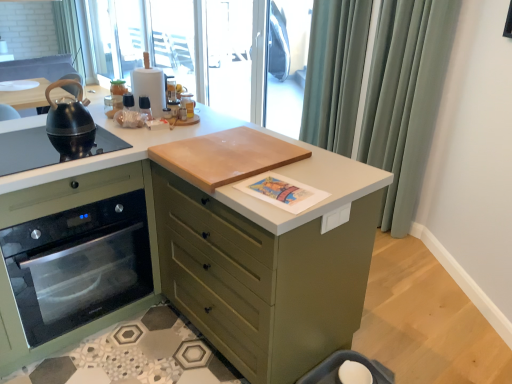
Describe the element at coordinates (27, 151) in the screenshot. I see `black matte gas stove at left` at that location.

What is the approximate width of white paper towel holder at upper center?

The width of white paper towel holder at upper center is 17.07 centimeters.

You are a GUI agent. You are given a task and a screenshot of the screen. Output one action in this format:
    pyautogui.click(x=<x>, y=<y>)
    Task: Click on the satin fabric curtain at upper right
    
    Given the screenshot: What is the action you would take?
    pyautogui.click(x=405, y=98)

At what (x,y) coordinates should I click in order to perform the action: click on black matte gas stove at left. Please return your answer as a coordinate pair (x, y). Looking at the image, I should click on (27, 151).

This screenshot has height=384, width=512. In order to click on the 1st screen door above the satin green oven at left (from the image's perspective) in this screenshot , I will do `click(287, 64)`.

Looking at this image, is satin green oven at left far from transparent plastic screen door at upper center, which ranks as the 2th screen door in left-to-right order?

Indeed, satin green oven at left is not near transparent plastic screen door at upper center, which ranks as the 2th screen door in left-to-right order.

Considering the sizes of transparent glass window at upper center, the 2th window screen in the back-to-front sequence, and transparent plastic window screen at upper center, positioned as the 1th window screen in left-to-right order, in the image, is transparent glass window at upper center, the 2th window screen in the back-to-front sequence, wider or thinner than transparent plastic window screen at upper center, positioned as the 1th window screen in left-to-right order,?

Clearly, transparent glass window at upper center, the 2th window screen in the back-to-front sequence, has less width compared to transparent plastic window screen at upper center, positioned as the 1th window screen in left-to-right order.

Is transparent glass window at upper center, which appears as the 1th window screen when viewed from the right, not close to transparent plastic window screen at upper center, the 2th window screen in the front-to-back sequence?

No, transparent glass window at upper center, which appears as the 1th window screen when viewed from the right, is not far away from transparent plastic window screen at upper center, the 2th window screen in the front-to-back sequence.

Considering the relative positions of transparent glass window at upper center, which appears as the second window screen when viewed from the left, and transparent plastic window screen at upper center, positioned as the 1th window screen in left-to-right order, in the image provided, is transparent glass window at upper center, which appears as the second window screen when viewed from the left, to the left or to the right of transparent plastic window screen at upper center, positioned as the 1th window screen in left-to-right order,?

transparent glass window at upper center, which appears as the second window screen when viewed from the left, is to the right of transparent plastic window screen at upper center, positioned as the 1th window screen in left-to-right order.

How far apart are transparent glass window at upper center, the 2th window screen in the back-to-front sequence, and transparent plastic window screen at upper center, the 1th window screen viewed from the back?

transparent glass window at upper center, the 2th window screen in the back-to-front sequence, is 4.14 inches from transparent plastic window screen at upper center, the 1th window screen viewed from the back.

Can you tell me how much white matte countertop at center and transparent plastic screen door at upper center, which ranks as the 2th screen door in left-to-right order, differ in facing direction?

The angular difference between white matte countertop at center and transparent plastic screen door at upper center, which ranks as the 2th screen door in left-to-right order, is 0.788 degrees.

From a real-world perspective, which is physically below, white matte countertop at center or transparent plastic screen door at upper center, positioned as the 1th screen door in right-to-left order?

white matte countertop at center.

Which is in front, white matte countertop at center or transparent plastic screen door at upper center, which ranks as the 2th screen door in left-to-right order?

white matte countertop at center.

Which object is positioned more to the right, white matte countertop at center or transparent plastic screen door at upper center, which ranks as the 2th screen door in left-to-right order?

From the viewer's perspective, transparent plastic screen door at upper center, which ranks as the 2th screen door in left-to-right order, appears more on the right side.

From the image's perspective, which is above, satin fabric curtain at upper right or transparent plastic screen door at upper center, which ranks as the 2th screen door in left-to-right order?

transparent plastic screen door at upper center, which ranks as the 2th screen door in left-to-right order, is shown above in the image.

Is point (419, 114) positioned behind point (304, 88)?

No, it is not.

Is there a large distance between satin fabric curtain at upper right and transparent plastic screen door at upper center, positioned as the 1th screen door in right-to-left order?

satin fabric curtain at upper right is positioned a significant distance from transparent plastic screen door at upper center, positioned as the 1th screen door in right-to-left order.

Considering the sizes of satin fabric curtain at upper right and transparent plastic screen door at upper center, which ranks as the 2th screen door in left-to-right order, in the image, is satin fabric curtain at upper right wider or thinner than transparent plastic screen door at upper center, which ranks as the 2th screen door in left-to-right order,?

In the image, satin fabric curtain at upper right appears to be wider than transparent plastic screen door at upper center, which ranks as the 2th screen door in left-to-right order.

Does transparent glass window at upper center, acting as the first window screen starting from the front, have a smaller size compared to satin green oven at left?

Correct, transparent glass window at upper center, acting as the first window screen starting from the front, occupies less space than satin green oven at left.

Is there a large distance between transparent glass window at upper center, the 2th window screen in the back-to-front sequence, and satin green oven at left?

Yes, transparent glass window at upper center, the 2th window screen in the back-to-front sequence, and satin green oven at left are located far from each other.

Is transparent glass window at upper center, which appears as the second window screen when viewed from the left, further to the viewer compared to satin green oven at left?

Yes.

Is transparent glass window at upper center, which appears as the second window screen when viewed from the left, taller than satin green oven at left?

Yes.

From a real-world perspective, which object stands above the other?

transparent glass window at upper center, which appears as the second window screen when viewed from the left, from a real-world perspective.

Consider the image. Is the surface of transparent glass window at upper center, the 2th window screen in the back-to-front sequence, in direct contact with transparent glass screen door at upper center, which is counted as the second screen door, starting from the right?

No, transparent glass window at upper center, the 2th window screen in the back-to-front sequence, is not in contact with transparent glass screen door at upper center, which is counted as the second screen door, starting from the right.

Considering the relative sizes of transparent glass window at upper center, the 2th window screen in the back-to-front sequence, and transparent glass screen door at upper center, the 1th screen door in the left-to-right sequence, in the image provided, is transparent glass window at upper center, the 2th window screen in the back-to-front sequence, smaller than transparent glass screen door at upper center, the 1th screen door in the left-to-right sequence,?

No.

From a real-world perspective, which is physically below, wooden cutting board at center or white paper towel holder at upper center?

wooden cutting board at center is physically lower.

Can you tell me how much wooden cutting board at center and white paper towel holder at upper center differ in facing direction?

1.45 degrees.

Is wooden cutting board at center not near white paper towel holder at upper center?

No, wooden cutting board at center is not far away from white paper towel holder at upper center.

From the image's perspective, which is above, wooden cutting board at center or white paper towel holder at upper center?

white paper towel holder at upper center appears higher in the image.

You are a GUI agent. You are given a task and a screenshot of the screen. Output one action in this format:
    pyautogui.click(x=<x>, y=<y>)
    Task: Click on the 2nd screen door to the right of the satin green oven at left, counting from the anchor's position
    This screenshot has height=384, width=512.
    Given the screenshot: What is the action you would take?
    pyautogui.click(x=287, y=64)

The width and height of the screenshot is (512, 384). I want to click on window screen behind the transparent glass window at upper center, acting as the first window screen starting from the front, so (x=145, y=37).

Looking at the image, which one is located further to transparent plastic screen door at upper center, which ranks as the 2th screen door in left-to-right order, transparent glass screen door at upper center, which is counted as the second screen door, starting from the right, or satin fabric curtain at upper right?

The object further to transparent plastic screen door at upper center, which ranks as the 2th screen door in left-to-right order, is satin fabric curtain at upper right.

When comparing their distances from wooden cutting board at center, does transparent plastic window screen at upper center, which appears as the second window screen when viewed from the right, or satin green oven at left seem further?

transparent plastic window screen at upper center, which appears as the second window screen when viewed from the right, is further to wooden cutting board at center.

From the image, which object appears to be nearer to white paper towel holder at upper center, white matte countertop at center or black matte gas stove at left?

Among the two, black matte gas stove at left is located nearer to white paper towel holder at upper center.

Looking at the image, which one is located closer to white matte countertop at center, transparent plastic window screen at upper center, positioned as the 1th window screen in left-to-right order, or satin fabric curtain at upper right?

Among the two, satin fabric curtain at upper right is located nearer to white matte countertop at center.

When comparing their distances from satin green oven at left, does transparent plastic window screen at upper center, the 2th window screen in the front-to-back sequence, or wooden cutting board at center seem closer?

Based on the image, wooden cutting board at center appears to be nearer to satin green oven at left.

From the image, which object appears to be farther from white paper towel holder at upper center, satin green oven at left or transparent plastic window screen at upper center, positioned as the 1th window screen in left-to-right order?

Among the two, transparent plastic window screen at upper center, positioned as the 1th window screen in left-to-right order, is located further to white paper towel holder at upper center.

Estimate the real-world distances between objects in this image. Which object is closer to wooden cutting board at center, transparent plastic screen door at upper center, which ranks as the 2th screen door in left-to-right order, or satin fabric curtain at upper right?

Based on the image, satin fabric curtain at upper right appears to be nearer to wooden cutting board at center.

Looking at the image, which one is located closer to transparent plastic screen door at upper center, which ranks as the 2th screen door in left-to-right order, transparent glass screen door at upper center, the 1th screen door in the left-to-right sequence, or transparent glass window at upper center, the 2th window screen in the back-to-front sequence?

transparent glass screen door at upper center, the 1th screen door in the left-to-right sequence, is closer to transparent plastic screen door at upper center, which ranks as the 2th screen door in left-to-right order.

Identify the location of appliance between wooden cutting board at center and transparent glass screen door at upper center, which is counted as the second screen door, starting from the right, in the front-back direction. (150, 86).

You are a GUI agent. You are given a task and a screenshot of the screen. Output one action in this format:
    pyautogui.click(x=<x>, y=<y>)
    Task: Click on the window screen between satin fabric curtain at upper right and transparent glass screen door at upper center, the 1th screen door in the left-to-right sequence, from front to back
    This screenshot has width=512, height=384.
    Given the screenshot: What is the action you would take?
    pyautogui.click(x=285, y=64)

I want to click on appliance located between black matte gas stove at left and transparent plastic screen door at upper center, which ranks as the 2th screen door in left-to-right order, in the depth direction, so click(150, 86).

The width and height of the screenshot is (512, 384). In order to click on window screen between black matte gas stove at left and transparent glass screen door at upper center, which is counted as the second screen door, starting from the right, along the z-axis in this screenshot , I will do `click(285, 64)`.